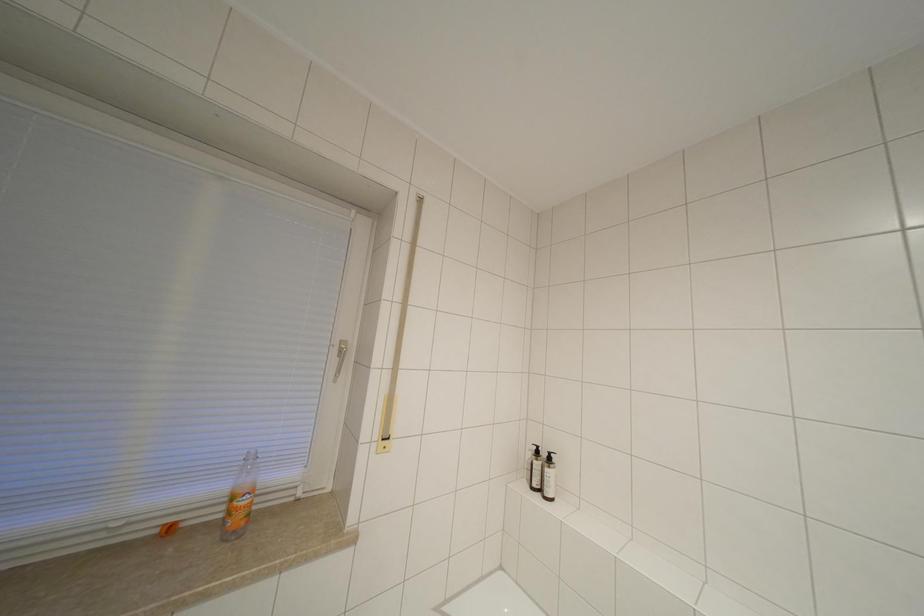
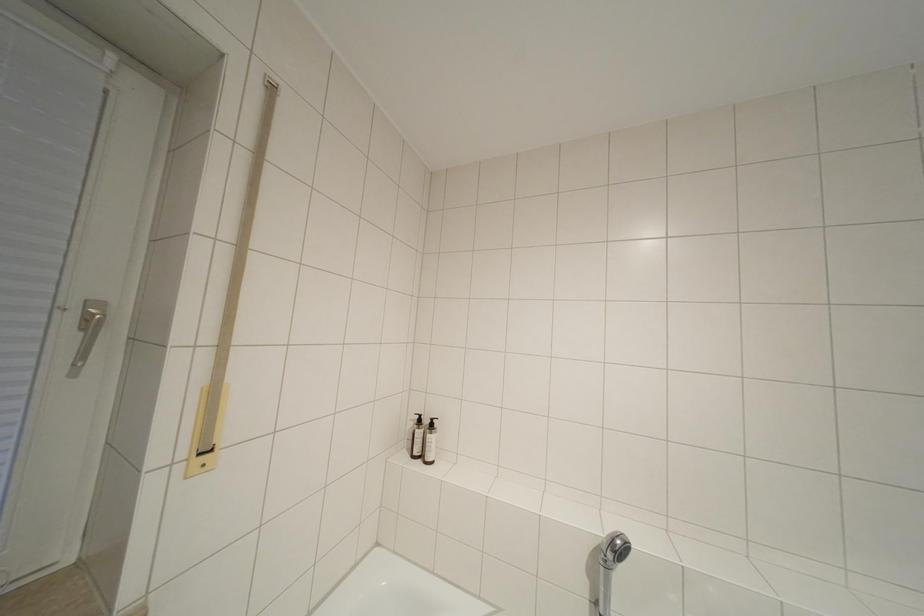
Question: The camera is either moving clockwise (left) or counter-clockwise (right) around the object. The first image is from the beginning of the video and the second image is from the end. Is the camera moving left or right when shooting the video?

Choices:
 (A) Left
 (B) Right

Answer: (A)